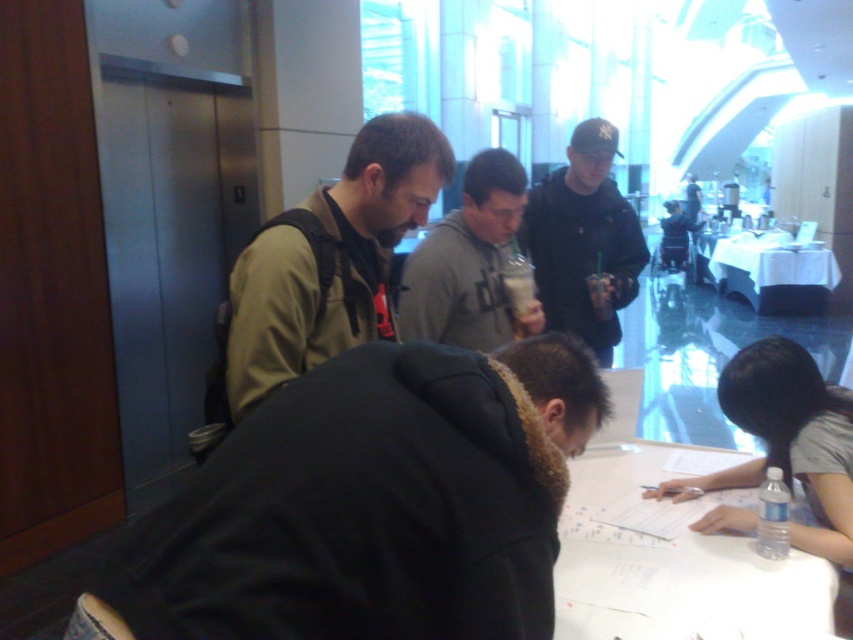
You are a photographer setting up a shoot in this room. You need to position a light source so that it illuminates both the black matte jacket at upper center and the gray matte hoodie at center without casting harsh shadows. Based on their positions, where should you place the light source relative to these objects?

Since the black matte jacket at upper center is above the gray matte hoodie at center, placing the light source above both objects would ensure even illumination and minimize harsh shadows between them.

You are standing in the room and looking at the table. There are two points marked on the table surface. The first point is at coordinate point (618, 259) and the second point is at coordinate point (466, 192). Which point is closer to you?

Point (618, 259) is further to the camera than point (466, 192), so the second point at (466, 192) is closer to you.